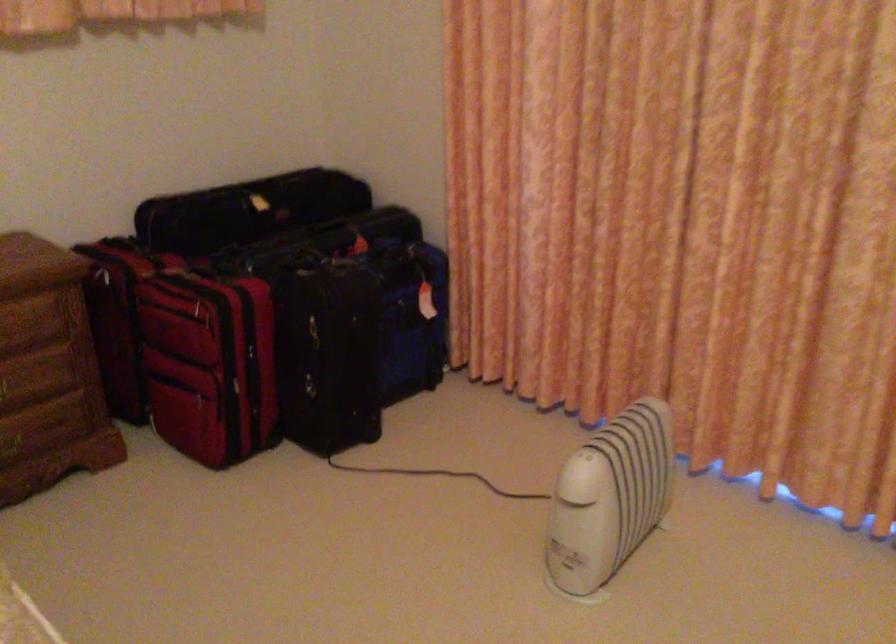
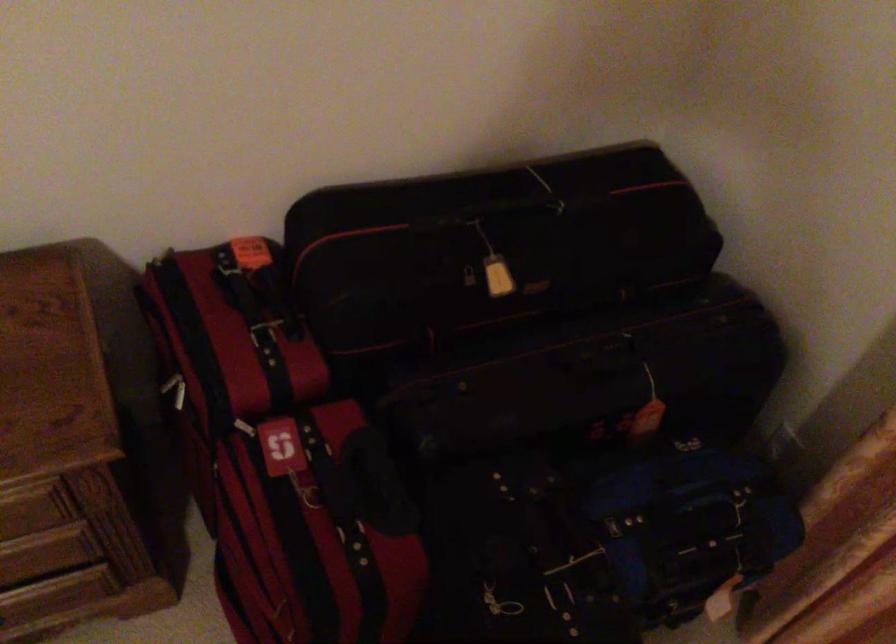
Locate, in the second image, the point that corresponds to point 290,230 in the first image.

(527, 357)